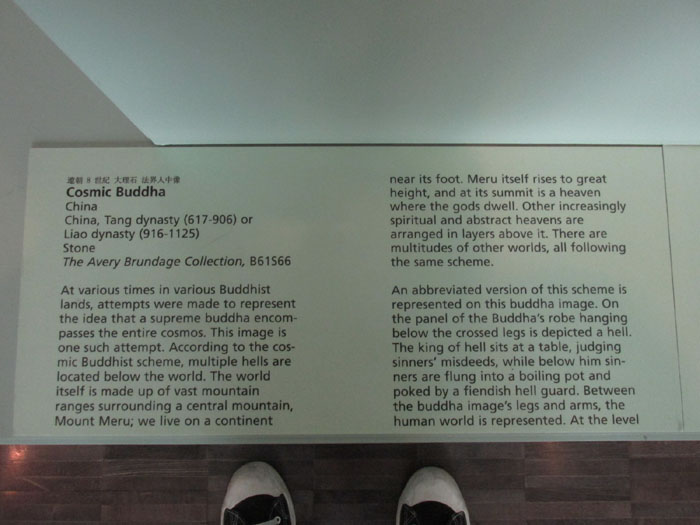
Locate an element on the screen. triangular tan design on left side of wall is located at coordinates (17, 32), (77, 93), (97, 122), (48, 123), (10, 134), (13, 188), (3, 288).